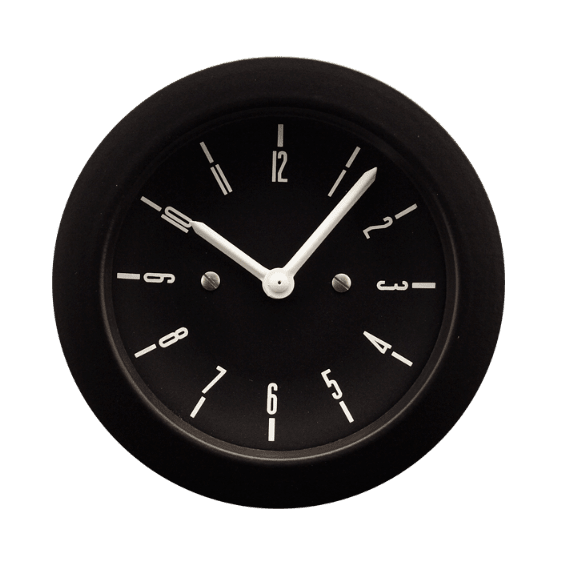
Locate an element on the screen. clock is located at coordinates (377, 319).